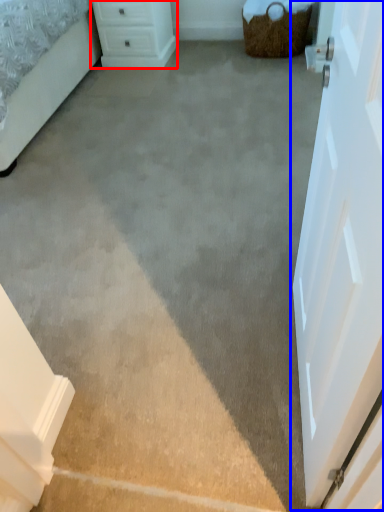
Question: Which of the following is the closest to the observer, chest of drawers (highlighted by a red box) or door (highlighted by a blue box)?

Choices:
 (A) chest of drawers
 (B) door

Answer: (B)